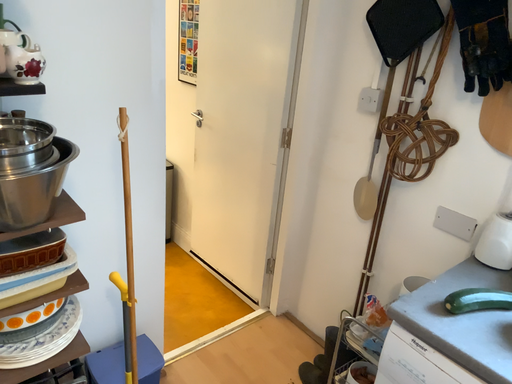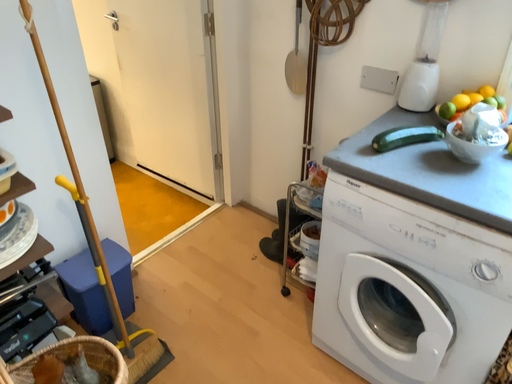
Question: Which way did the camera rotate in the video?

Choices:
 (A) rotated left
 (B) rotated right

Answer: (B)